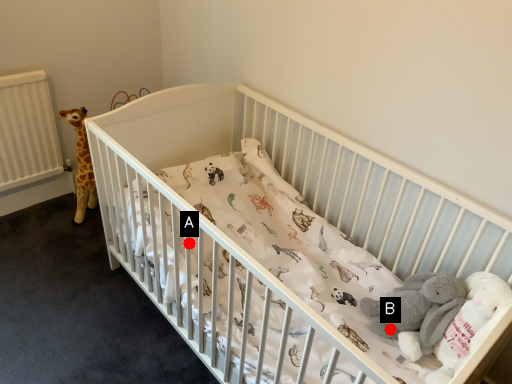
Question: Two points are circled on the image, labeled by A and B beside each circle. Which point is closer to the camera?

Choices:
 (A) A is closer
 (B) B is closer

Answer: (B)